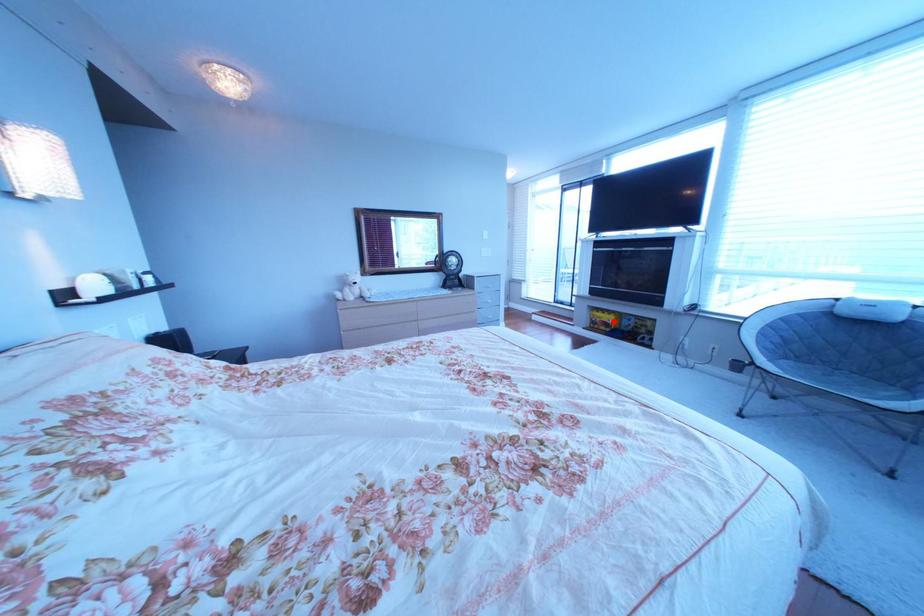
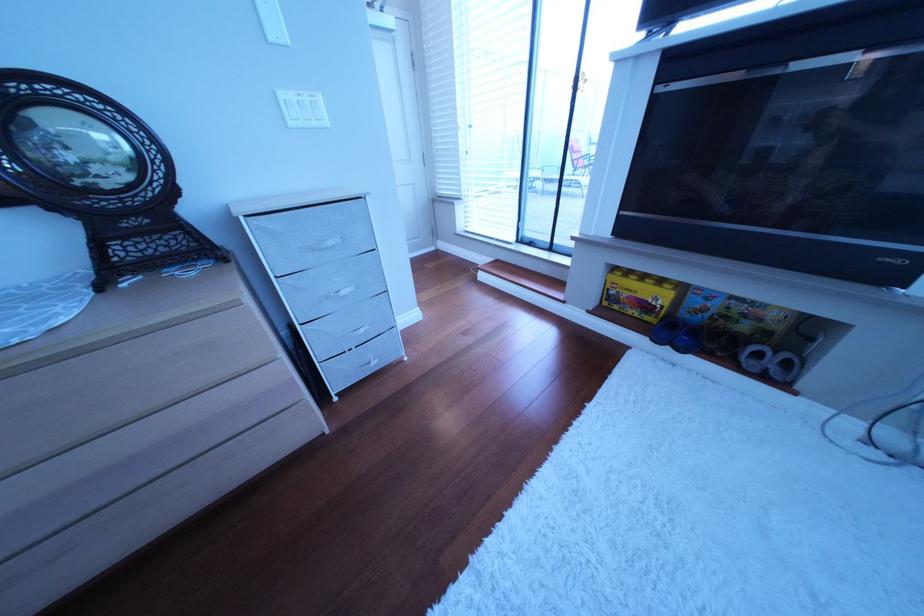
Question: I am providing you with two images of the same scene from different viewpoints. A red point is marked on the first image. Can you still see the location of the red point in image 2?

Choices:
 (A) Yes
 (B) No

Answer: (A)